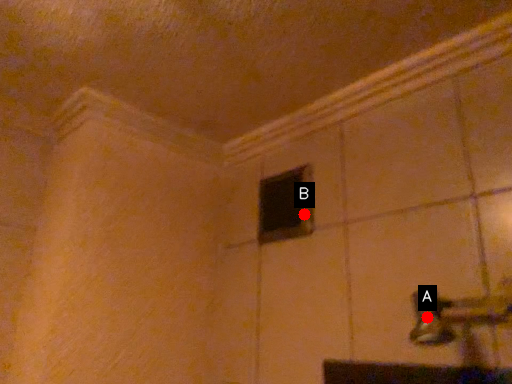
Question: Two points are circled on the image, labeled by A and B beside each circle. Which point is closer to the camera?

Choices:
 (A) A is closer
 (B) B is closer

Answer: (A)